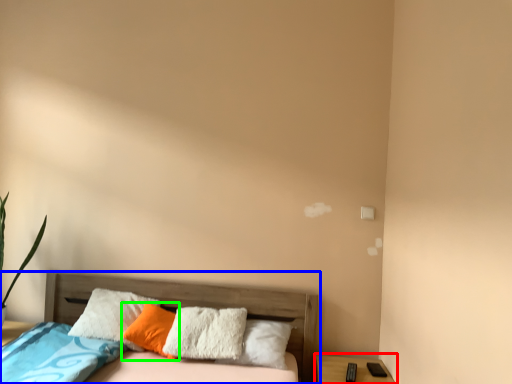
Question: Which object is the closest to the nightstand (highlighted by a red box)? Choose among these: bed (highlighted by a blue box) or pillow (highlighted by a green box).

Choices:
 (A) bed
 (B) pillow

Answer: (A)